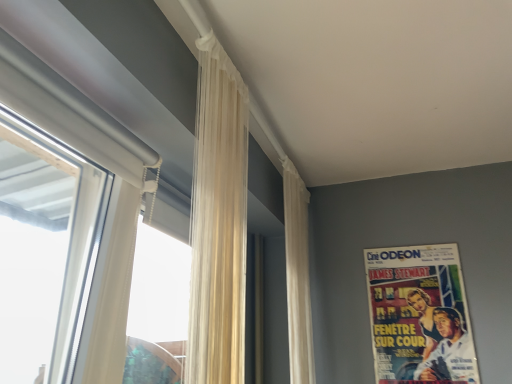
Question: Considering the positions of white sheer curtain at upper center, which ranks as the second curtain in front-to-back order, and vintage paper poster at upper right in the image, is white sheer curtain at upper center, which ranks as the second curtain in front-to-back order, bigger or smaller than vintage paper poster at upper right?

Choices:
 (A) small
 (B) big

Answer: (B)

Question: In the image, is white sheer curtain at upper center, which is counted as the second curtain, starting from the left, positioned in front of or behind vintage paper poster at upper right?

Choices:
 (A) front
 (B) behind

Answer: (A)

Question: Based on their relative distances, which object is farther from the translucent cream curtain at center, the 2th curtain positioned from the right?

Choices:
 (A) white sheer curtain at upper center, which ranks as the second curtain in front-to-back order
 (B) white matte window at left
 (C) vintage paper poster at upper right

Answer: (C)

Question: Which object is positioned farthest from the translucent cream curtain at center, placed as the 1th curtain when sorted from front to back?

Choices:
 (A) white matte window at left
 (B) white sheer curtain at upper center, which is the first curtain in right-to-left order
 (C) vintage paper poster at upper right

Answer: (C)